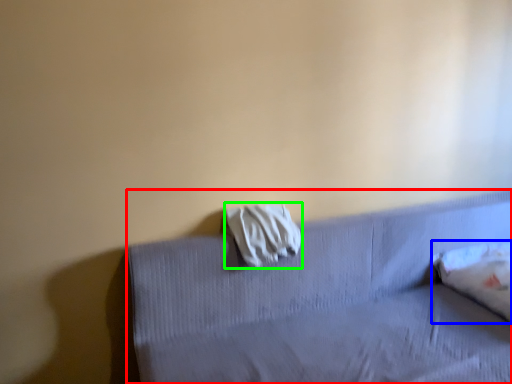
Question: Which object is positioned closest to furniture (highlighted by a red box)? Select from pillow (highlighted by a blue box) and material (highlighted by a green box).

Choices:
 (A) pillow
 (B) material

Answer: (B)